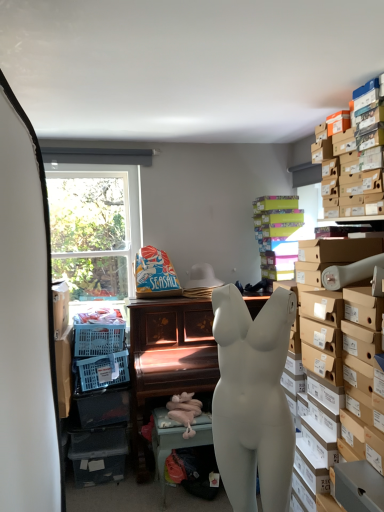
Where is `white matte mannequin torso at center`? The height and width of the screenshot is (512, 384). white matte mannequin torso at center is located at coordinates (253, 399).

I want to click on pink fabric toy at lower center, the first toy in the bottom-to-top sequence, so click(184, 411).

Measure the distance between white matte table at lower center, positioned as the first table in front-to-back order, and camera.

A distance of 8.59 feet exists between white matte table at lower center, positioned as the first table in front-to-back order, and camera.

The width and height of the screenshot is (384, 512). Describe the element at coordinates (277, 234) in the screenshot. I see `multicolored cardboard boxes at upper right, which ranks as the 1th shelf in back-to-front order` at that location.

Locate an element on the screen. white matte mannequin torso at center is located at coordinates (253, 399).

Between multicolored cardboard boxes at upper right, placed as the 2th shelf when sorted from front to back, and seaside-themed paper bag at center, the 2th toy when ordered from front to back, which one appears on the right side from the viewer's perspective?

From the viewer's perspective, multicolored cardboard boxes at upper right, placed as the 2th shelf when sorted from front to back, appears more on the right side.

From the image's perspective, relative to seaside-themed paper bag at center, placed as the 1th toy when sorted from top to bottom, is multicolored cardboard boxes at upper right, placed as the 2th shelf when sorted from front to back, above or below?

From the image's perspective, multicolored cardboard boxes at upper right, placed as the 2th shelf when sorted from front to back, appears above seaside-themed paper bag at center, placed as the 1th toy when sorted from top to bottom.

Is multicolored cardboard boxes at upper right, which ranks as the 1th shelf in back-to-front order, positioned with its back to seaside-themed paper bag at center, the 2th toy when ordered from front to back?

That's not correct — multicolored cardboard boxes at upper right, which ranks as the 1th shelf in back-to-front order, is not looking away from seaside-themed paper bag at center, the 2th toy when ordered from front to back.

Which of these two, multicolored cardboard boxes at upper right, placed as the 2th shelf when sorted from front to back, or seaside-themed paper bag at center, arranged as the first toy when viewed from the back, stands shorter?

seaside-themed paper bag at center, arranged as the first toy when viewed from the back.

Is white matte mannequin torso at center further to the viewer compared to seaside-themed paper bag at center, placed as the 1th toy when sorted from top to bottom?

No, the depth of white matte mannequin torso at center is less than that of seaside-themed paper bag at center, placed as the 1th toy when sorted from top to bottom.

Is point (281, 322) farther from camera compared to point (157, 294)?

No.

Is seaside-themed paper bag at center, the 2th toy positioned from the bottom, at the back of white matte mannequin torso at center?

That's not correct — white matte mannequin torso at center is not looking away from seaside-themed paper bag at center, the 2th toy positioned from the bottom.

Based on the photo, can you confirm if multicolored cardboard boxes at upper right, which ranks as the 1th shelf in back-to-front order, is wider than pink fabric toy at lower center, positioned as the second toy in back-to-front order?

Indeed, multicolored cardboard boxes at upper right, which ranks as the 1th shelf in back-to-front order, has a greater width compared to pink fabric toy at lower center, positioned as the second toy in back-to-front order.

Considering the sizes of multicolored cardboard boxes at upper right, placed as the 2th shelf when sorted from front to back, and pink fabric toy at lower center, positioned as the second toy in back-to-front order, in the image, is multicolored cardboard boxes at upper right, placed as the 2th shelf when sorted from front to back, taller or shorter than pink fabric toy at lower center, positioned as the second toy in back-to-front order,?

multicolored cardboard boxes at upper right, placed as the 2th shelf when sorted from front to back, is taller than pink fabric toy at lower center, positioned as the second toy in back-to-front order.

Does multicolored cardboard boxes at upper right, which ranks as the 1th shelf in back-to-front order, turn towards pink fabric toy at lower center, the first toy in the bottom-to-top sequence?

No, multicolored cardboard boxes at upper right, which ranks as the 1th shelf in back-to-front order, is not facing towards pink fabric toy at lower center, the first toy in the bottom-to-top sequence.

The image size is (384, 512). Find the location of `shelf behind the pink fabric toy at lower center, the first toy in the bottom-to-top sequence`. shelf behind the pink fabric toy at lower center, the first toy in the bottom-to-top sequence is located at coordinates (277, 234).

Can you confirm if pink fabric toy at lower center, positioned as the second toy in back-to-front order, is smaller than white matte table at lower center, positioned as the first table in front-to-back order?

Indeed, pink fabric toy at lower center, positioned as the second toy in back-to-front order, has a smaller size compared to white matte table at lower center, positioned as the first table in front-to-back order.

Which point is more distant from viewer, (188, 416) or (195, 428)?

Positioned behind is point (188, 416).

Considering the sizes of pink fabric toy at lower center, the 1th toy positioned from the front, and white matte table at lower center, acting as the 2th table starting from the back, in the image, is pink fabric toy at lower center, the 1th toy positioned from the front, taller or shorter than white matte table at lower center, acting as the 2th table starting from the back,?

Clearly, pink fabric toy at lower center, the 1th toy positioned from the front, is shorter compared to white matte table at lower center, acting as the 2th table starting from the back.

Would you say pink fabric toy at lower center, positioned as the second toy in back-to-front order, is outside white matte table at lower center, acting as the 2th table starting from the back?

No.

Which is more to the left, white matte table at lower center, acting as the 2th table starting from the back, or wooden piano at center, which is the 2th table from front to back?

Positioned to the left is wooden piano at center, which is the 2th table from front to back.

Who is smaller, white matte table at lower center, positioned as the first table in front-to-back order, or wooden piano at center, the first table viewed from the back?

white matte table at lower center, positioned as the first table in front-to-back order.

Can you confirm if white matte table at lower center, positioned as the first table in front-to-back order, is shorter than wooden piano at center, the first table viewed from the back?

Yes, white matte table at lower center, positioned as the first table in front-to-back order, is shorter than wooden piano at center, the first table viewed from the back.

Is point (172, 435) in front of point (178, 403)?

Yes, point (172, 435) is closer to viewer.

Can you tell me how much white matte table at lower center, acting as the 2th table starting from the back, and pink fabric toy at lower center, the 1th toy positioned from the front, differ in facing direction?

The angle between the facing direction of white matte table at lower center, acting as the 2th table starting from the back, and the facing direction of pink fabric toy at lower center, the 1th toy positioned from the front, is 147 degrees.

Who is more distant, white matte table at lower center, acting as the 2th table starting from the back, or pink fabric toy at lower center, the 1th toy positioned from the front?

white matte table at lower center, acting as the 2th table starting from the back.

Which of these two, white matte table at lower center, positioned as the first table in front-to-back order, or pink fabric toy at lower center, the first toy in the bottom-to-top sequence, stands shorter?

pink fabric toy at lower center, the first toy in the bottom-to-top sequence.

Could you tell me if white matte mannequin torso at center is facing brown cardboard boxes at upper right, which is the first shelf in front-to-back order?

No, white matte mannequin torso at center does not turn towards brown cardboard boxes at upper right, which is the first shelf in front-to-back order.

Is white matte mannequin torso at center surrounding brown cardboard boxes at upper right, which is the first shelf in front-to-back order?

Definitely not — brown cardboard boxes at upper right, which is the first shelf in front-to-back order, is not inside white matte mannequin torso at center.

Considering the relative sizes of white matte mannequin torso at center and brown cardboard boxes at upper right, which is the second shelf from back to front, in the image provided, is white matte mannequin torso at center thinner than brown cardboard boxes at upper right, which is the second shelf from back to front,?

Indeed, white matte mannequin torso at center has a lesser width compared to brown cardboard boxes at upper right, which is the second shelf from back to front.

Which toy is the 2nd one when counting from the left side of the multicolored cardboard boxes at upper right, placed as the 2th shelf when sorted from front to back? Please provide its 2D coordinates.

[(155, 274)]

Locate an element on the screen. toy that is the 2nd one when counting backward from the white matte mannequin torso at center is located at coordinates (155, 274).

Looking at this image, from the image, which object appears to be farther from multicolored cardboard boxes at upper right, placed as the 2th shelf when sorted from front to back, white matte mannequin torso at center or wooden piano at center, the first table viewed from the back?

white matte mannequin torso at center is further to multicolored cardboard boxes at upper right, placed as the 2th shelf when sorted from front to back.

Considering their positions, is brown cardboard boxes at upper right, which is the second shelf from back to front, positioned further to pink fabric toy at lower center, the 1th toy positioned from the front, than wooden piano at center, the first table viewed from the back?

The object further to pink fabric toy at lower center, the 1th toy positioned from the front, is brown cardboard boxes at upper right, which is the second shelf from back to front.

Looking at the image, which one is located further to pink fabric toy at lower center, the first toy in the bottom-to-top sequence, wooden piano at center, which is the 2th table from front to back, or white matte table at lower center, acting as the 2th table starting from the back?

wooden piano at center, which is the 2th table from front to back.

Looking at the image, which one is located closer to brown cardboard boxes at upper right, which is the first shelf in front-to-back order, white matte mannequin torso at center or multicolored cardboard boxes at upper right, which ranks as the 1th shelf in back-to-front order?

multicolored cardboard boxes at upper right, which ranks as the 1th shelf in back-to-front order, is closer to brown cardboard boxes at upper right, which is the first shelf in front-to-back order.

Considering their positions, is white matte mannequin torso at center positioned further to multicolored cardboard boxes at upper right, placed as the 2th shelf when sorted from front to back, than brown cardboard boxes at upper right, which is the first shelf in front-to-back order?

Among the two, white matte mannequin torso at center is located further to multicolored cardboard boxes at upper right, placed as the 2th shelf when sorted from front to back.

When comparing their distances from white matte table at lower center, acting as the 2th table starting from the back, does pink fabric toy at lower center, the first toy in the bottom-to-top sequence, or white matte mannequin torso at center seem closer?

The object closer to white matte table at lower center, acting as the 2th table starting from the back, is pink fabric toy at lower center, the first toy in the bottom-to-top sequence.

From the image, which object appears to be farther from multicolored cardboard boxes at upper right, which ranks as the 1th shelf in back-to-front order, wooden piano at center, the first table viewed from the back, or brown cardboard boxes at upper right, which is the second shelf from back to front?

wooden piano at center, the first table viewed from the back, lies further to multicolored cardboard boxes at upper right, which ranks as the 1th shelf in back-to-front order, than the other object.

From the image, which object appears to be farther from seaside-themed paper bag at center, the 2th toy positioned from the bottom, wooden piano at center, which is the 2th table from front to back, or multicolored cardboard boxes at upper right, placed as the 2th shelf when sorted from front to back?

Based on the image, multicolored cardboard boxes at upper right, placed as the 2th shelf when sorted from front to back, appears to be further to seaside-themed paper bag at center, the 2th toy positioned from the bottom.

You are a GUI agent. You are given a task and a screenshot of the screen. Output one action in this format:
    pyautogui.click(x=<x>, y=<y>)
    Task: Click on the toy between multicolored cardboard boxes at upper right, placed as the 2th shelf when sorted from front to back, and pink fabric toy at lower center, the 1th toy positioned from the front, from top to bottom
    The width and height of the screenshot is (384, 512).
    Given the screenshot: What is the action you would take?
    pyautogui.click(x=155, y=274)

I want to click on toy between brown cardboard boxes at upper right, which is the first shelf in front-to-back order, and pink fabric toy at lower center, the first toy in the bottom-to-top sequence, vertically, so click(x=155, y=274).

Where is `table between brown cardboard boxes at upper right, which is the first shelf in front-to-back order, and white matte table at lower center, positioned as the first table in front-to-back order, in the up-down direction`? table between brown cardboard boxes at upper right, which is the first shelf in front-to-back order, and white matte table at lower center, positioned as the first table in front-to-back order, in the up-down direction is located at coordinates (169, 358).

I want to click on toy between multicolored cardboard boxes at upper right, which ranks as the 1th shelf in back-to-front order, and wooden piano at center, the first table viewed from the back, from top to bottom, so click(155, 274).